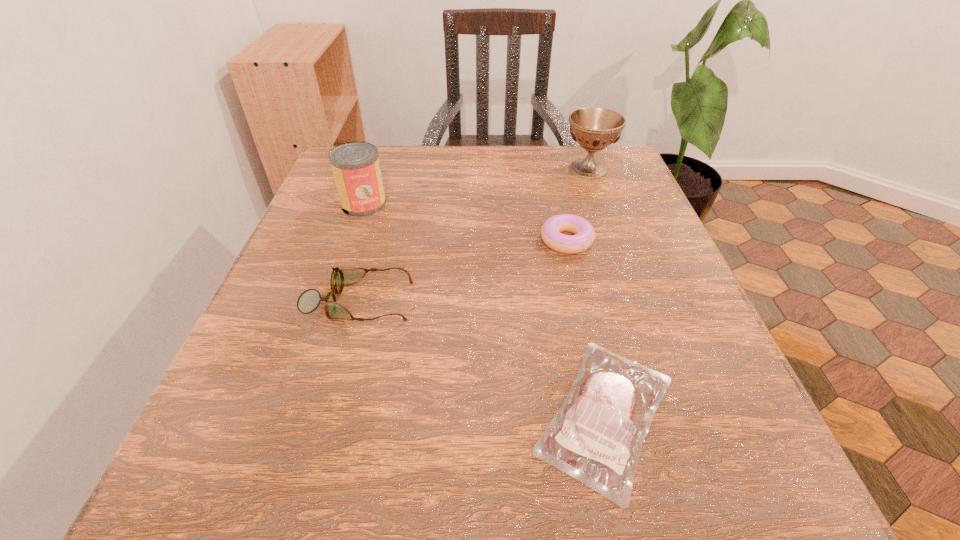
Locate an element on the screen. This screenshot has height=540, width=960. the farthest object is located at coordinates (594, 128).

At what (x,y) coordinates should I click in order to perform the action: click on can. Please return your answer as a coordinate pair (x, y). Looking at the image, I should click on (356, 169).

Locate an element on the screen. This screenshot has height=540, width=960. the third shortest object is located at coordinates (309, 300).

The image size is (960, 540). I want to click on the second nearest object, so click(309, 300).

Image resolution: width=960 pixels, height=540 pixels. I want to click on the third farthest object, so click(584, 236).

Find the location of a particular element. This screenshot has height=540, width=960. doughnut is located at coordinates (584, 236).

This screenshot has width=960, height=540. I want to click on the shortest object, so click(596, 437).

What are the coordinates of `the nearest object` in the screenshot? It's located at (596, 437).

The height and width of the screenshot is (540, 960). Identify the location of blank area located on the front of the chalice. (612, 236).

Locate an element on the screen. free space located on the front of the can is located at coordinates (327, 309).